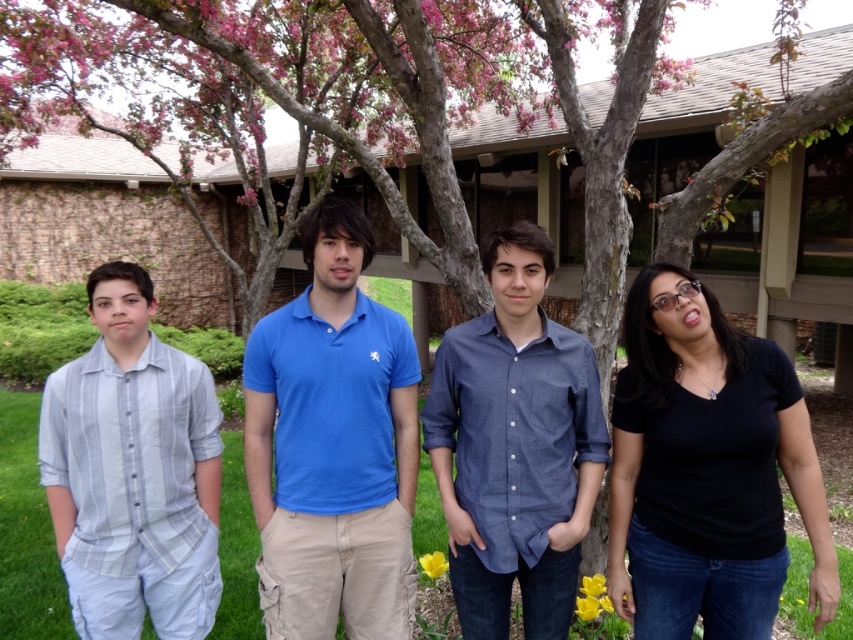
Who is higher up, black matte shirt at right or blue cotton polo shirt at center?

blue cotton polo shirt at center is higher up.

Can you confirm if black matte shirt at right is positioned below blue cotton polo shirt at center?

Yes, black matte shirt at right is below blue cotton polo shirt at center.

Is point (663, 548) positioned after point (251, 422)?

No, (663, 548) is closer to viewer.

Locate an element on the screen. black matte shirt at right is located at coordinates (706, 470).

Which of these two, black matte shirt at right or blue denim shirt at center, stands shorter?

black matte shirt at right is shorter.

Which is more to the left, black matte shirt at right or blue denim shirt at center?

Positioned to the left is blue denim shirt at center.

Between point (741, 440) and point (561, 472), which one is positioned behind?

Positioned behind is point (561, 472).

Where is `black matte shirt at right`? black matte shirt at right is located at coordinates (706, 470).

Between point (550, 365) and point (47, 477), which one is positioned in front?

Point (550, 365)

Is blue denim shirt at center to the right of light blue striped shirt at left from the viewer's perspective?

Indeed, blue denim shirt at center is positioned on the right side of light blue striped shirt at left.

Find the location of `blue denim shirt at center`. blue denim shirt at center is located at coordinates (515, 445).